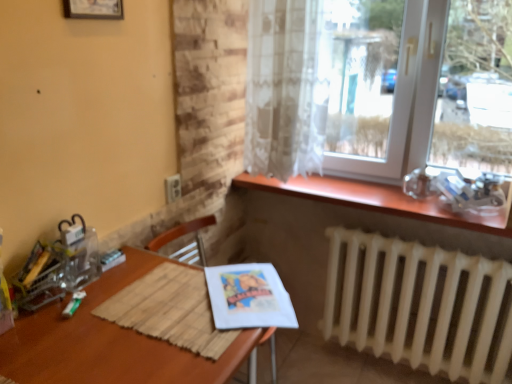
Question: Is wooden at upper right to the left of sheer white curtain at upper right from the viewer's perspective?

Choices:
 (A) yes
 (B) no

Answer: (B)

Question: Is the depth of wooden at upper right greater than that of sheer white curtain at upper right?

Choices:
 (A) yes
 (B) no

Answer: (A)

Question: Is wooden at upper right to the right of sheer white curtain at upper right from the viewer's perspective?

Choices:
 (A) no
 (B) yes

Answer: (B)

Question: Can you confirm if wooden at upper right is bigger than sheer white curtain at upper right?

Choices:
 (A) yes
 (B) no

Answer: (B)

Question: Considering the relative sizes of wooden at upper right and sheer white curtain at upper right in the image provided, is wooden at upper right thinner than sheer white curtain at upper right?

Choices:
 (A) yes
 (B) no

Answer: (B)

Question: Does wooden at upper right have a smaller size compared to sheer white curtain at upper right?

Choices:
 (A) no
 (B) yes

Answer: (B)

Question: Considering the relative positions of wooden at upper right and matte paper magazine at lower center in the image provided, is wooden at upper right behind matte paper magazine at lower center?

Choices:
 (A) yes
 (B) no

Answer: (B)

Question: Is wooden at upper right in front of matte paper magazine at lower center?

Choices:
 (A) yes
 (B) no

Answer: (A)

Question: Is wooden at upper right turned away from matte paper magazine at lower center?

Choices:
 (A) yes
 (B) no

Answer: (B)

Question: Is wooden at upper right wider than matte paper magazine at lower center?

Choices:
 (A) no
 (B) yes

Answer: (B)

Question: From a real-world perspective, is wooden at upper right beneath matte paper magazine at lower center?

Choices:
 (A) yes
 (B) no

Answer: (B)

Question: Does wooden at upper right appear on the right side of matte paper magazine at lower center?

Choices:
 (A) yes
 (B) no

Answer: (A)

Question: Can you confirm if white matte radiator at lower right is thinner than sheer white curtain at upper right?

Choices:
 (A) yes
 (B) no

Answer: (A)